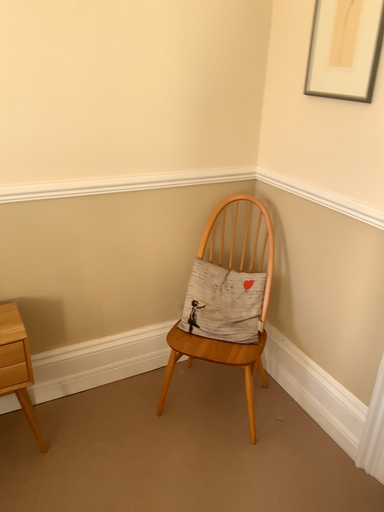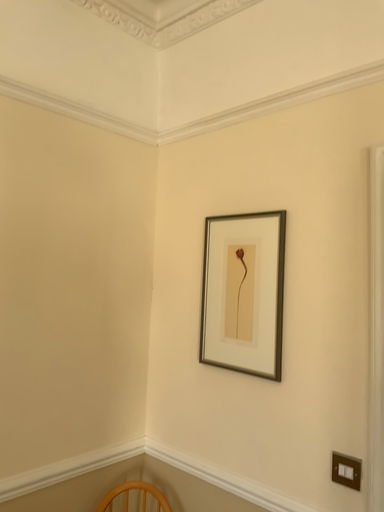
Question: Which way did the camera rotate in the video?

Choices:
 (A) rotated left
 (B) rotated right

Answer: (B)